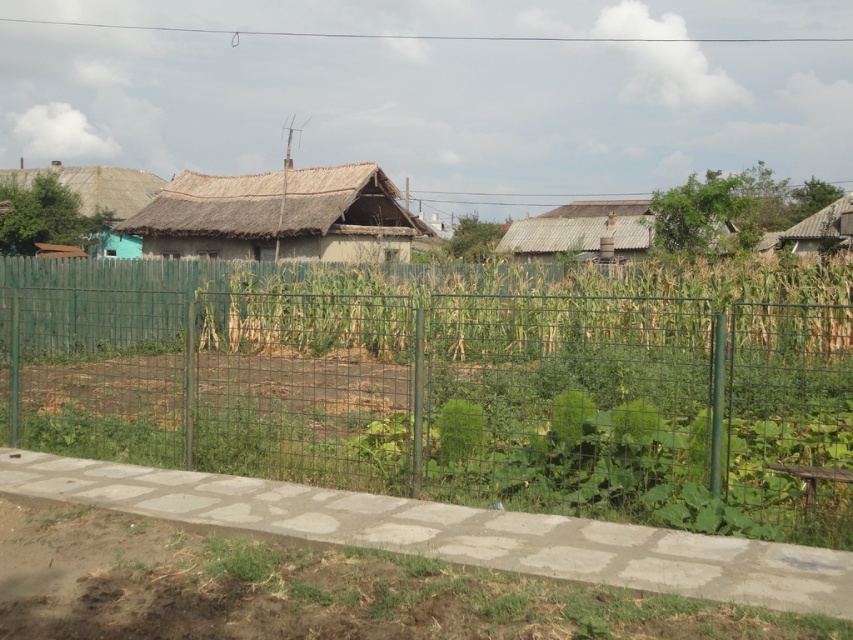
Where is `thatched straw hut at center`? thatched straw hut at center is located at coordinates (279, 216).

Describe the element at coordinates (279, 216) in the screenshot. This screenshot has width=853, height=640. I see `thatched straw hut at center` at that location.

Identify the location of thatched straw hut at center. The image size is (853, 640). (279, 216).

Who is lower down, green wire mesh fence at center or thatched straw hut at center?

green wire mesh fence at center is below.

Can you confirm if green wire mesh fence at center is positioned above thatched straw hut at center?

Actually, green wire mesh fence at center is below thatched straw hut at center.

What are the coordinates of `green wire mesh fence at center` in the screenshot? It's located at (444, 394).

Does green wire mesh fence at center have a lesser height compared to brown thatched hut at upper right?

Indeed, green wire mesh fence at center has a lesser height compared to brown thatched hut at upper right.

Can you confirm if green wire mesh fence at center is positioned above brown thatched hut at upper right?

No, green wire mesh fence at center is not above brown thatched hut at upper right.

At what (x,y) coordinates should I click in order to perform the action: click on green wire mesh fence at center. Please return your answer as a coordinate pair (x, y). This screenshot has width=853, height=640. Looking at the image, I should click on click(444, 394).